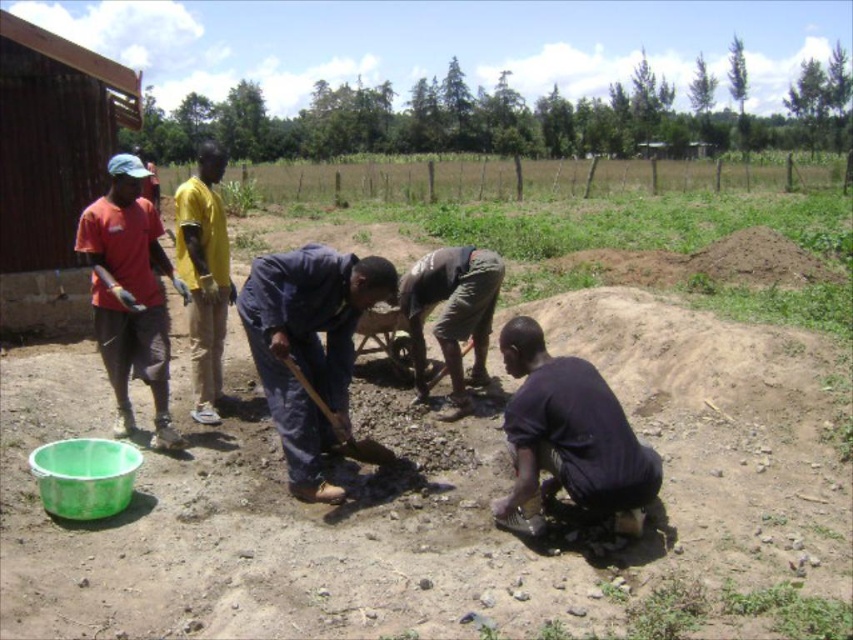
Question: Which point is closer to the camera taking this photo?

Choices:
 (A) (198, 333)
 (B) (131, 356)

Answer: (B)

Question: Can you confirm if yellow fabric shirt at center is positioned above wooden shovel at center?

Choices:
 (A) yes
 (B) no

Answer: (A)

Question: Does matte red shirt at left appear under yellow fabric shirt at center?

Choices:
 (A) no
 (B) yes

Answer: (B)

Question: Which point is farther to the camera?

Choices:
 (A) brown soil at lower center
 (B) wooden shovel at center
 (C) dark blue shirt at lower right
 (D) dark brown fabric shirt at center

Answer: (D)

Question: Does dark blue jeans at center appear on the left side of dark blue shirt at lower right?

Choices:
 (A) yes
 (B) no

Answer: (A)

Question: Which object appears farthest from the camera in this image?

Choices:
 (A) matte red shirt at left
 (B) brown soil at lower center

Answer: (A)